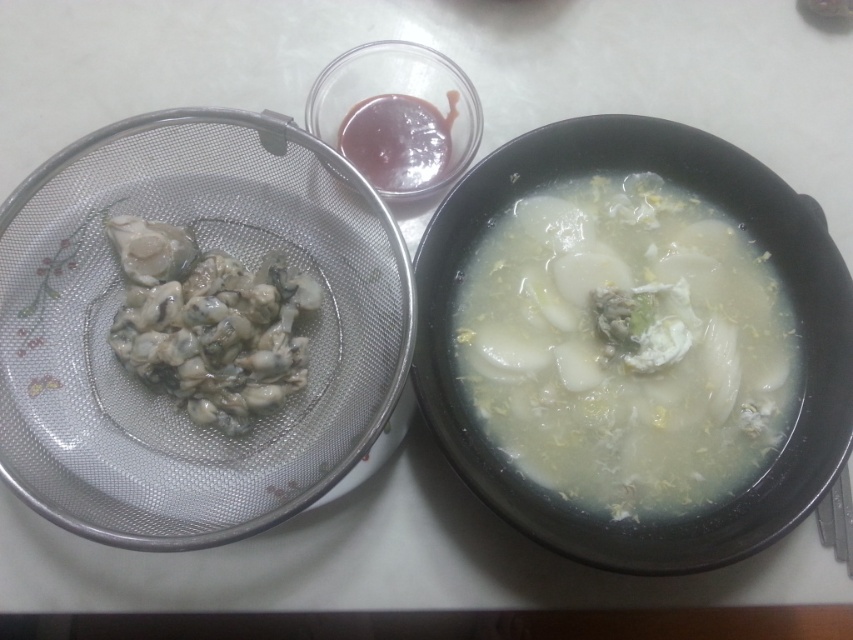
Question: Which point appears closest to the camera in this image?

Choices:
 (A) (450, 148)
 (B) (546, 387)

Answer: (B)

Question: Is white translucent soup at center wider than smooth glossy sauce at upper center?

Choices:
 (A) yes
 (B) no

Answer: (A)

Question: Which point is closer to the camera?

Choices:
 (A) white translucent soup at center
 (B) grayish translucent oyster at left

Answer: (B)

Question: Which object is the closest to the grayish translucent oyster at left?

Choices:
 (A) smooth glossy sauce at upper center
 (B) white translucent soup at center

Answer: (A)

Question: Can you confirm if white translucent soup at center is bigger than smooth glossy sauce at upper center?

Choices:
 (A) no
 (B) yes

Answer: (B)

Question: Is grayish translucent oyster at left to the right of smooth glossy sauce at upper center from the viewer's perspective?

Choices:
 (A) yes
 (B) no

Answer: (B)